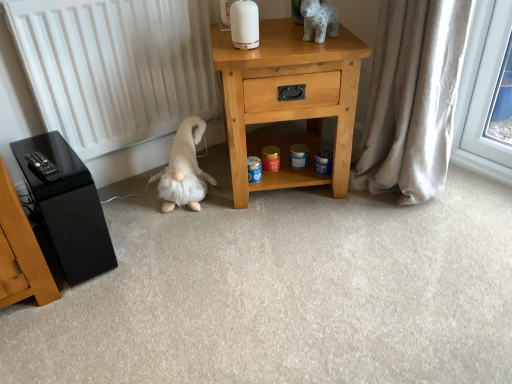
In order to click on free space between light wood nightstand at center and black glossy speaker at left in this screenshot , I will do `click(184, 221)`.